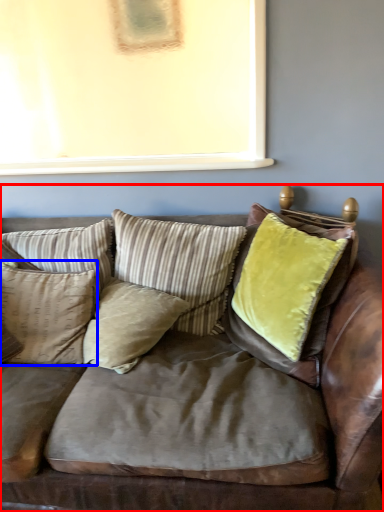
Question: Which point is closer to the camera, studio couch (highlighted by a red box) or pillow (highlighted by a blue box)?

Choices:
 (A) studio couch
 (B) pillow

Answer: (A)